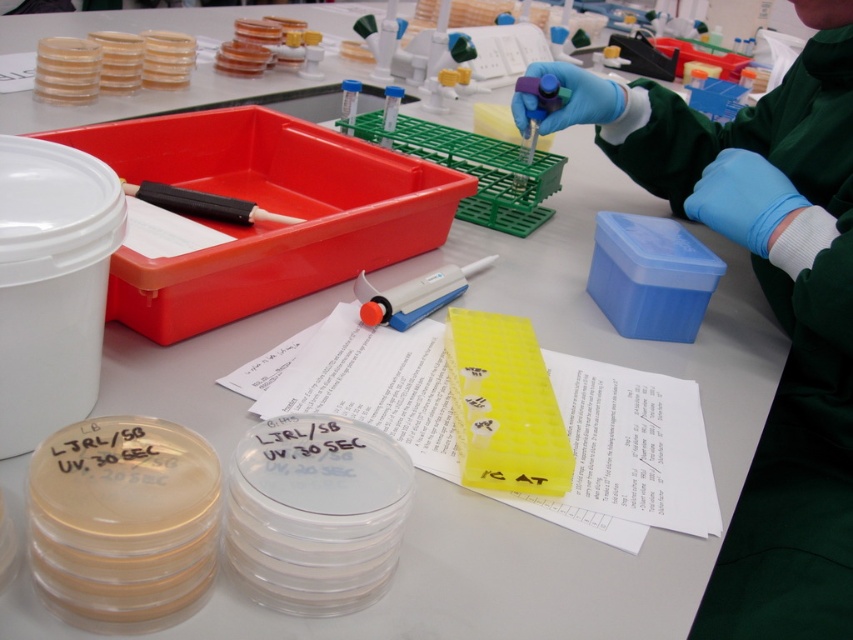
Can you confirm if blue latex glove at upper right is positioned below white plastic pipette at center?

Incorrect, blue latex glove at upper right is not positioned below white plastic pipette at center.

Who is more forward, (805, 547) or (404, 291)?

Point (805, 547) is in front.

Is point (747, 122) positioned after point (415, 308)?

That is True.

Identify the location of blue latex glove at upper right. This screenshot has height=640, width=853. (770, 308).